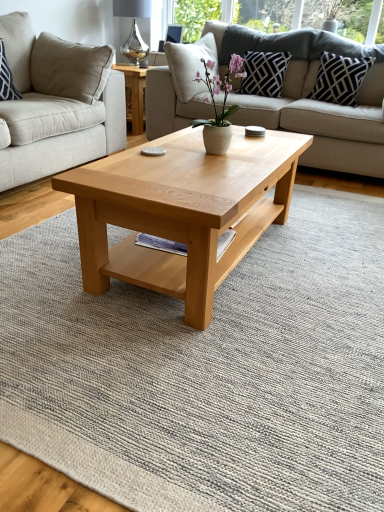
Question: Considering the positions of blue and white striped pillow at upper left, acting as the first pillow starting from the left, and dark blue geometric-patterned pillow at upper right, placed as the 3th pillow when sorted from left to right, in the image, is blue and white striped pillow at upper left, acting as the first pillow starting from the left, wider or thinner than dark blue geometric-patterned pillow at upper right, placed as the 3th pillow when sorted from left to right,?

Choices:
 (A) thin
 (B) wide

Answer: (A)

Question: Does point (29, 70) appear closer or farther from the camera than point (322, 69)?

Choices:
 (A) closer
 (B) farther

Answer: (A)

Question: Estimate the real-world distances between objects in this image. Which object is farther from the blue and white striped pillow at upper left, which is the 3th pillow in right-to-left order?

Choices:
 (A) dark blue textured pillow at upper right, the second pillow in the left-to-right sequence
 (B) natural wood coffee table at center
 (C) light beige fabric couch at center, which is the 1th studio couch from right to left
 (D) beige fabric studio couch at center, acting as the first studio couch starting from the left
 (E) silver metallic lamp at upper center

Answer: (B)

Question: Estimate the real-world distances between objects in this image. Which object is farther from the beige fabric studio couch at center, acting as the first studio couch starting from the left?

Choices:
 (A) natural wood coffee table at center
 (B) light beige fabric couch at center, which is the 1th studio couch from right to left
 (C) dark blue textured pillow at upper right, the second pillow in the left-to-right sequence
 (D) silver metallic lamp at upper center
 (E) white matte vase at center

Answer: (D)